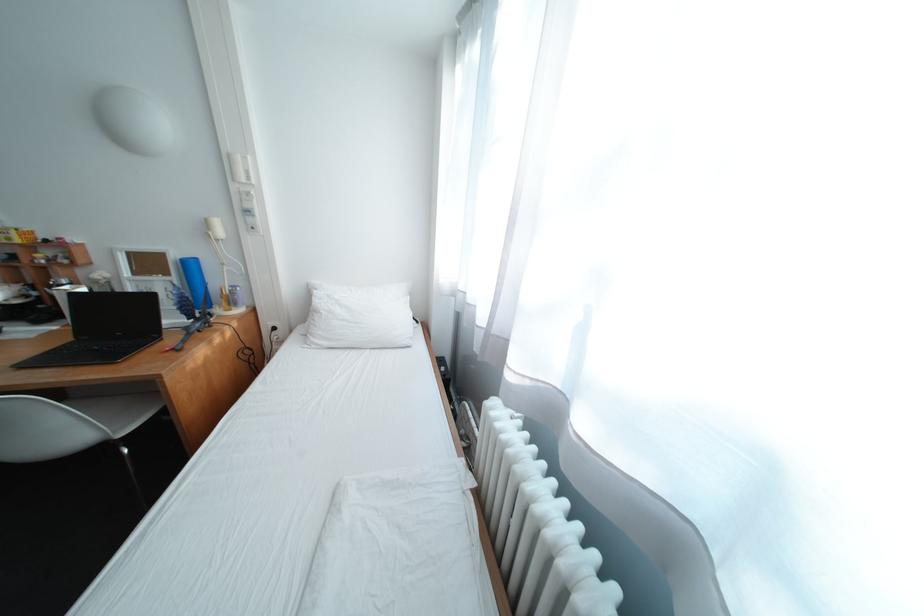
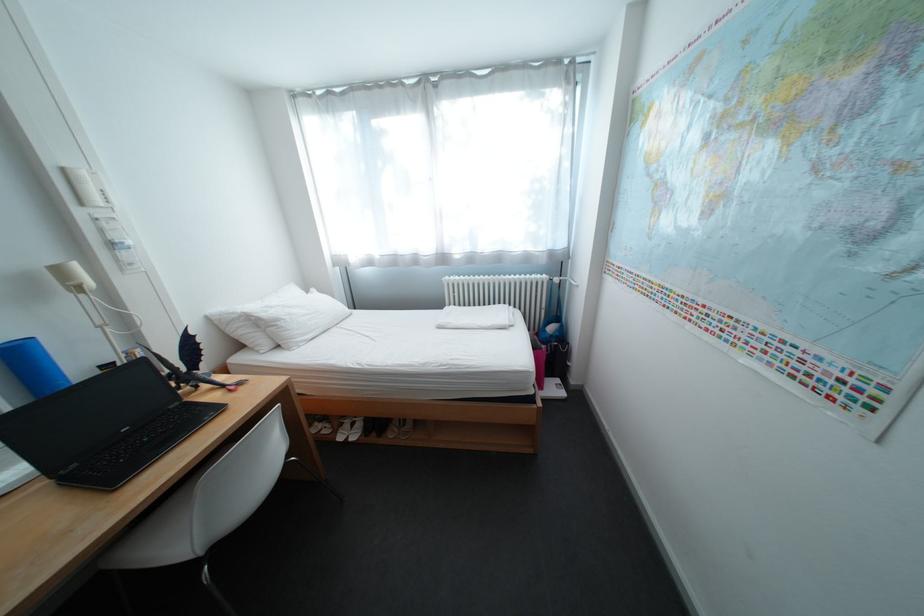
Find the pixel in the second image that matches the point at 242,156 in the first image.

(76, 171)